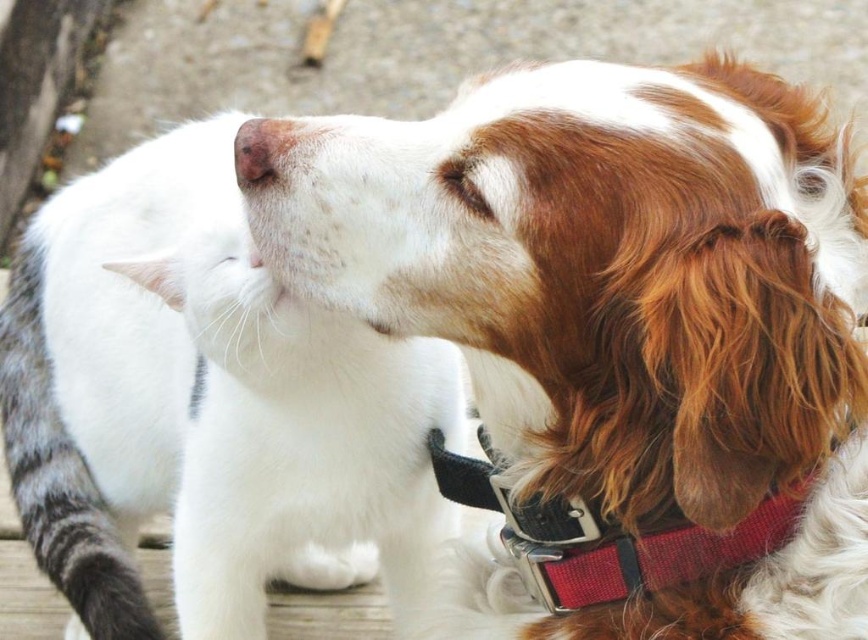
Find the location of a particular element. This screenshot has width=868, height=640. white fur cat at left is located at coordinates (202, 403).

Is point (738, 412) more distant than point (349, 582)?

No, (738, 412) is in front of (349, 582).

How much distance is there between white fur at center and white fur cat at left?

white fur at center and white fur cat at left are 13.21 inches apart from each other.

Image resolution: width=868 pixels, height=640 pixels. What do you see at coordinates (617, 333) in the screenshot?
I see `white fur at center` at bounding box center [617, 333].

Where is `white fur at center`? The height and width of the screenshot is (640, 868). white fur at center is located at coordinates (617, 333).

Who is more distant from viewer, (794, 492) or (262, 116)?

The point (262, 116) is behind.

The image size is (868, 640). What do you see at coordinates (606, 536) in the screenshot?
I see `red fabric collar at right` at bounding box center [606, 536].

Where is `red fabric collar at right`? Image resolution: width=868 pixels, height=640 pixels. red fabric collar at right is located at coordinates (606, 536).